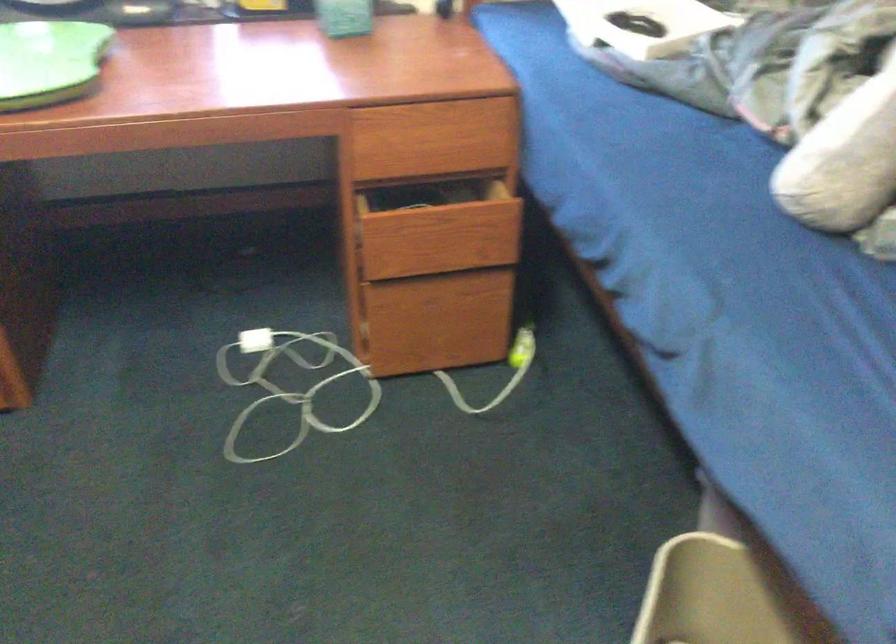
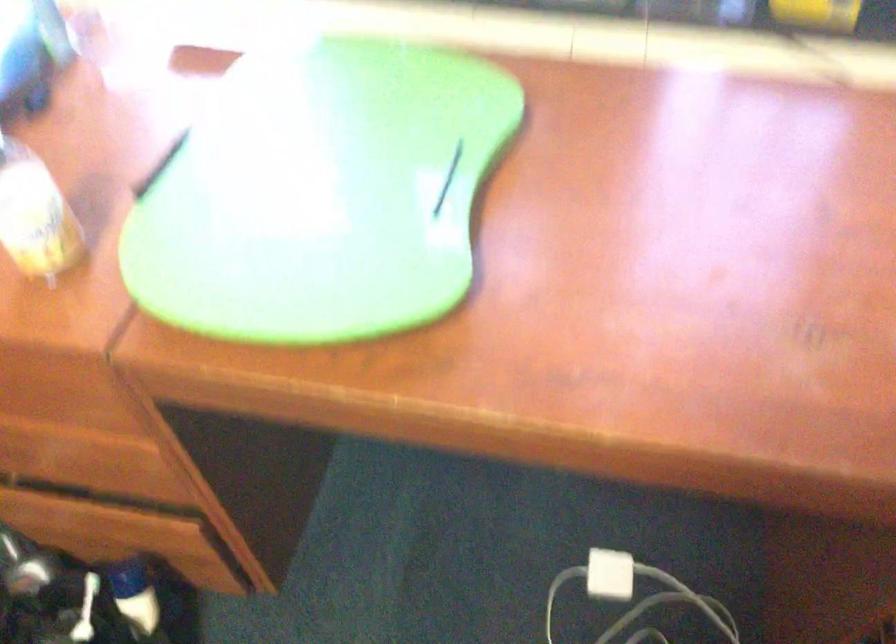
In a continuous first-person perspective shot, in which direction is the camera moving?

The cameraman walked toward left, forward.